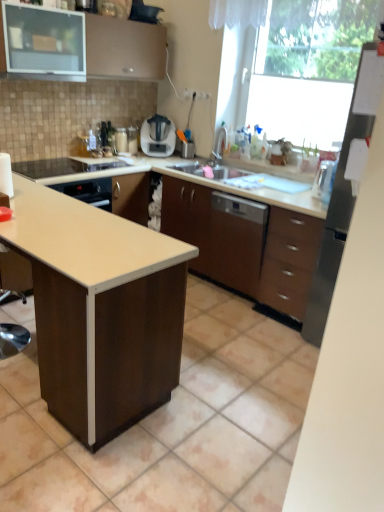
Question: From a real-world perspective, is stainless steel refrigerator at right positioned under matte brown cabinet at upper left, positioned as the first cabinetry in top-to-bottom order, based on gravity?

Choices:
 (A) no
 (B) yes

Answer: (B)

Question: Is stainless steel refrigerator at right directly adjacent to matte brown cabinet at upper left, positioned as the first cabinetry in top-to-bottom order?

Choices:
 (A) yes
 (B) no

Answer: (B)

Question: Is stainless steel refrigerator at right to the left of matte brown cabinet at upper left, marked as the first cabinetry in a left-to-right arrangement, from the viewer's perspective?

Choices:
 (A) no
 (B) yes

Answer: (A)

Question: From a real-world perspective, is stainless steel refrigerator at right over matte brown cabinet at upper left, marked as the first cabinetry in a left-to-right arrangement?

Choices:
 (A) no
 (B) yes

Answer: (A)

Question: From the image's perspective, is stainless steel refrigerator at right under matte brown cabinet at upper left, which is the 2th cabinetry from bottom to top?

Choices:
 (A) no
 (B) yes

Answer: (B)

Question: From the image's perspective, is stainless steel refrigerator at right positioned above or below transparent glass window at upper right?

Choices:
 (A) above
 (B) below

Answer: (B)

Question: Is stainless steel refrigerator at right wider or thinner than transparent glass window at upper right?

Choices:
 (A) thin
 (B) wide

Answer: (A)

Question: Based on their positions, is stainless steel refrigerator at right located to the left or right of transparent glass window at upper right?

Choices:
 (A) left
 (B) right

Answer: (B)

Question: Is point (350, 126) positioned closer to the camera than point (316, 16)?

Choices:
 (A) farther
 (B) closer

Answer: (B)

Question: Looking at the image, does white laminate table at center seem bigger or smaller compared to matte brown cabinet at upper left, which is the 2th cabinetry from bottom to top?

Choices:
 (A) big
 (B) small

Answer: (A)

Question: Considering the positions of white laminate table at center and matte brown cabinet at upper left, positioned as the first cabinetry in top-to-bottom order, in the image, is white laminate table at center wider or thinner than matte brown cabinet at upper left, positioned as the first cabinetry in top-to-bottom order,?

Choices:
 (A) thin
 (B) wide

Answer: (A)

Question: From their relative heights in the image, would you say white laminate table at center is taller or shorter than matte brown cabinet at upper left, which is counted as the second cabinetry, starting from the right?

Choices:
 (A) tall
 (B) short

Answer: (A)

Question: Relative to matte brown cabinet at upper left, which is counted as the second cabinetry, starting from the right, is white laminate table at center in front or behind?

Choices:
 (A) front
 (B) behind

Answer: (A)

Question: In terms of width, does satin nickel faucet at upper right look wider or thinner when compared to brown matte cabinet at center, the first cabinetry when ordered from bottom to top?

Choices:
 (A) thin
 (B) wide

Answer: (A)

Question: In terms of height, does satin nickel faucet at upper right look taller or shorter compared to brown matte cabinet at center, the first cabinetry when ordered from bottom to top?

Choices:
 (A) short
 (B) tall

Answer: (A)